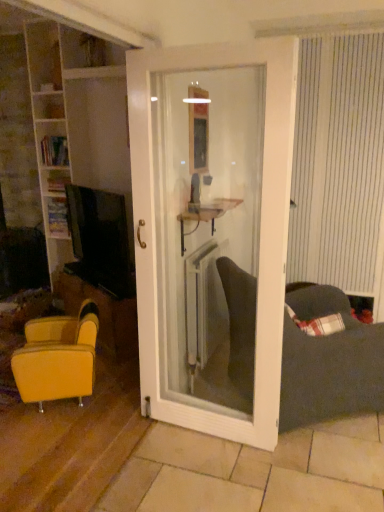
Question: From the image's perspective, is white metallic radiator at center located beneath white wood bookshelf at left?

Choices:
 (A) no
 (B) yes

Answer: (B)

Question: Is white metallic radiator at center positioned with its back to white wood bookshelf at left?

Choices:
 (A) yes
 (B) no

Answer: (A)

Question: Would you say white metallic radiator at center is outside white wood bookshelf at left?

Choices:
 (A) no
 (B) yes

Answer: (B)

Question: Is white metallic radiator at center with white wood bookshelf at left?

Choices:
 (A) yes
 (B) no

Answer: (B)

Question: From the image's perspective, does white metallic radiator at center appear higher than white wood bookshelf at left?

Choices:
 (A) no
 (B) yes

Answer: (A)

Question: Considering the relative positions of white metallic radiator at center and white wood bookshelf at left in the image provided, is white metallic radiator at center behind white wood bookshelf at left?

Choices:
 (A) yes
 (B) no

Answer: (B)

Question: Is wooden bookshelf at left taller than dark gray fabric couch at lower right?

Choices:
 (A) yes
 (B) no

Answer: (B)

Question: Are wooden bookshelf at left and dark gray fabric couch at lower right beside each other?

Choices:
 (A) yes
 (B) no

Answer: (B)

Question: Is wooden bookshelf at left oriented away from dark gray fabric couch at lower right?

Choices:
 (A) no
 (B) yes

Answer: (A)

Question: Is wooden bookshelf at left to the right of dark gray fabric couch at lower right from the viewer's perspective?

Choices:
 (A) no
 (B) yes

Answer: (A)

Question: Is wooden bookshelf at left not inside dark gray fabric couch at lower right?

Choices:
 (A) yes
 (B) no

Answer: (A)

Question: Is wooden bookshelf at left closer to the viewer compared to dark gray fabric couch at lower right?

Choices:
 (A) yes
 (B) no

Answer: (B)

Question: Is yellow leather chair at left, which is the 1th table in bottom-to-top order, further to camera compared to white metallic radiator at center?

Choices:
 (A) yes
 (B) no

Answer: (A)